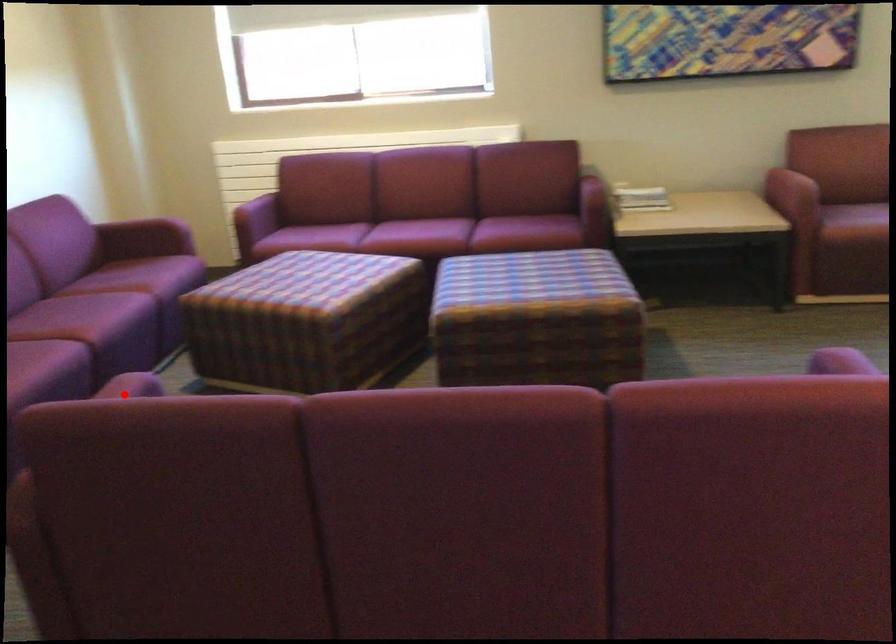
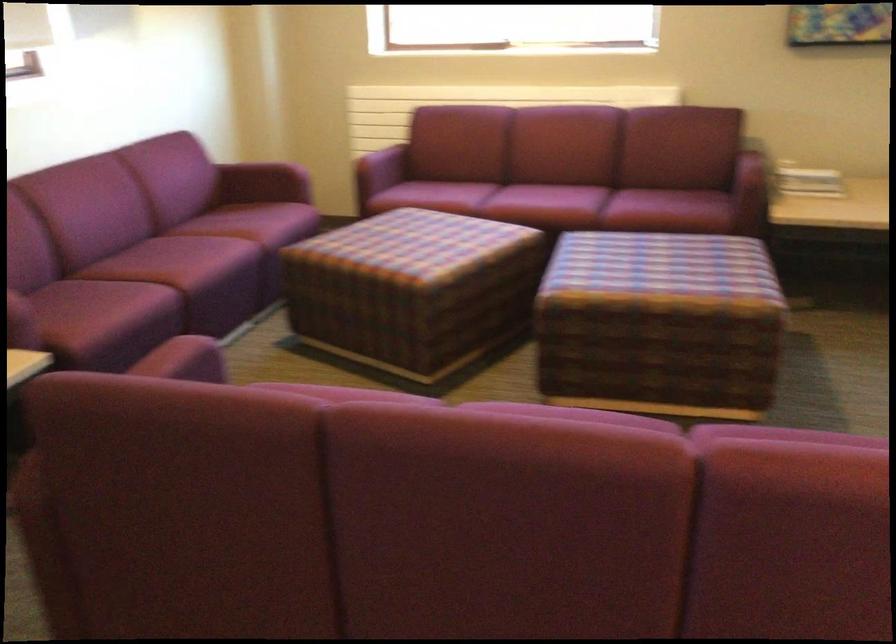
Find the pixel in the second image that matches the highlighted location in the first image.

(182, 359)